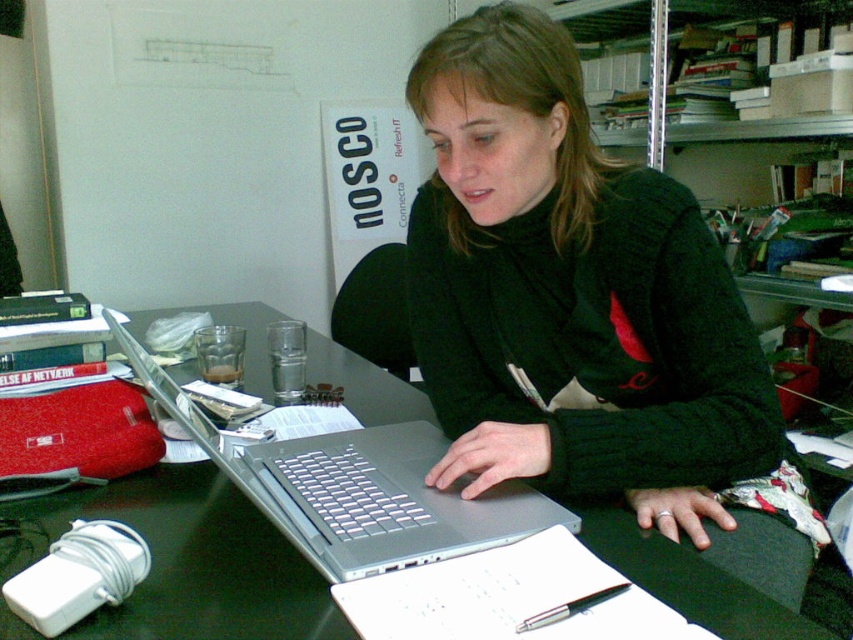
Which is more to the left, black matte sweater at center or metallic gray table at center?

metallic gray table at center is more to the left.

Does black matte sweater at center appear on the right side of metallic gray table at center?

Yes, black matte sweater at center is to the right of metallic gray table at center.

Who is more forward, (503, 429) or (9, 538)?

Point (9, 538)

Image resolution: width=853 pixels, height=640 pixels. I want to click on black matte sweater at center, so 587,314.

Between black matte sweater at center and silver metallic laptop at center, which one has less height?

Standing shorter between the two is silver metallic laptop at center.

The height and width of the screenshot is (640, 853). I want to click on black matte sweater at center, so click(587, 314).

Identify the location of black matte sweater at center. (587, 314).

Is point (238, 586) behind point (566, 509)?

No, it is not.

Does metallic gray table at center have a larger size compared to silver metallic laptop at center?

Actually, metallic gray table at center might be smaller than silver metallic laptop at center.

Locate an element on the screen. The image size is (853, 640). metallic gray table at center is located at coordinates (189, 561).